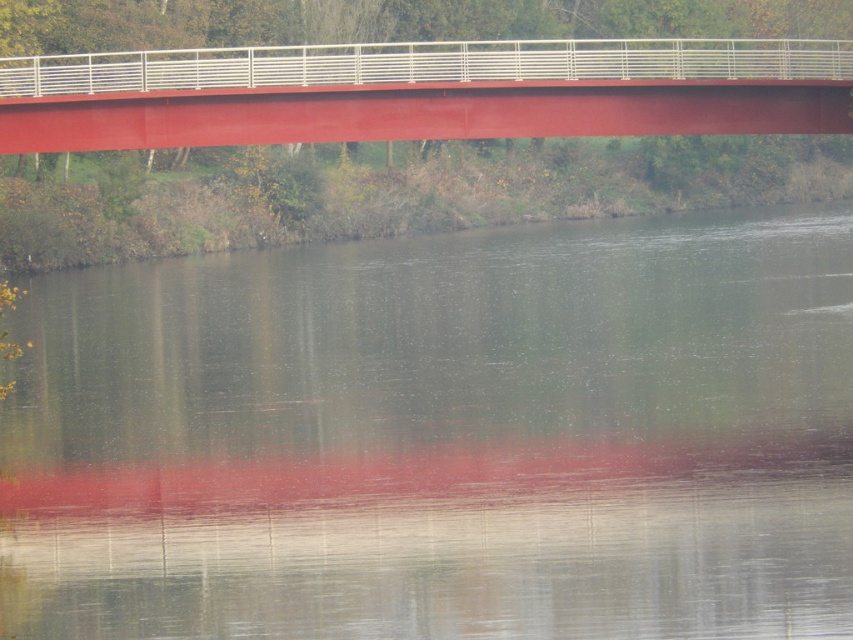
Between smooth water at center and metallic red bridge at upper center, which one has more height?

With more height is metallic red bridge at upper center.

Is point (769, 442) positioned in front of point (71, 92)?

That is False.

Locate an element on the screen. smooth water at center is located at coordinates (442, 438).

Where is `smooth water at center`? This screenshot has width=853, height=640. smooth water at center is located at coordinates (442, 438).